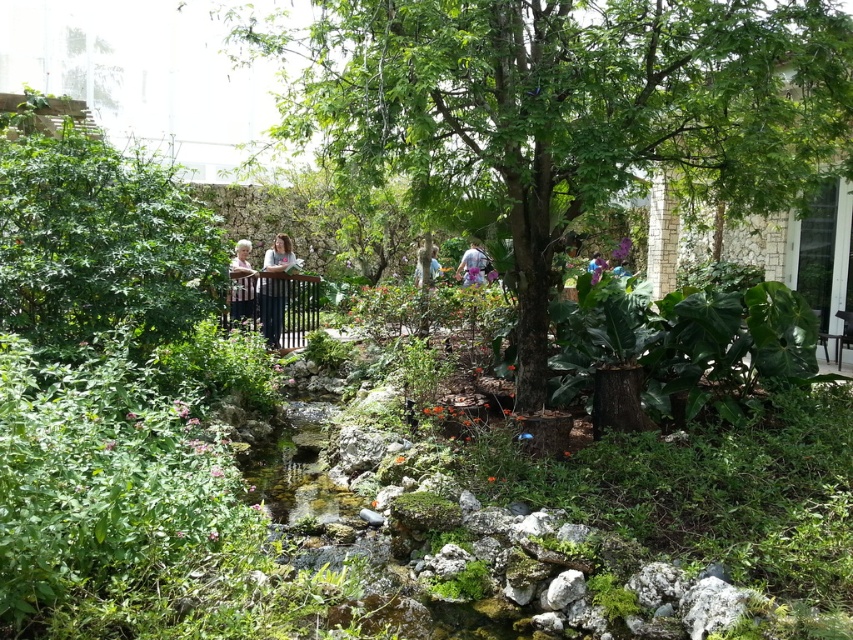
Question: Where is light purple fabric at center located in relation to light blue shirt at center in the image?

Choices:
 (A) left
 (B) right

Answer: (B)

Question: Can you confirm if green leafy tree at center is positioned above matte gray hair at center?

Choices:
 (A) yes
 (B) no

Answer: (A)

Question: Based on their relative distances, which object is farther from the light blue denim jeans at center?

Choices:
 (A) green leafy tree at center
 (B) light purple fabric at center
 (C) matte gray hair at center
 (D) black metal rail at center

Answer: (A)

Question: Which point is closer to the camera taking this photo?

Choices:
 (A) tap(250, 308)
 (B) tap(461, 272)
 (C) tap(265, 332)

Answer: (A)

Question: Which point is farther from the camera taking this photo?

Choices:
 (A) coord(469,259)
 (B) coord(253,284)
 (C) coord(434,262)
 (D) coord(538,131)

Answer: (C)

Question: Can you confirm if black metal rail at center is positioned above light purple fabric at center?

Choices:
 (A) no
 (B) yes

Answer: (A)